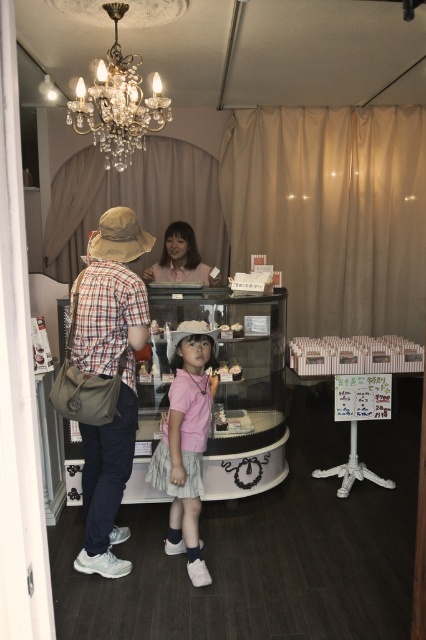
You are a photographer setting up a shoot in this bakery scene. You need to place a small tripod between the matte plaid shirt at center and the pink cotton shirt at center. Since the two shirts are overlapping, which shirt should the tripod be placed closer to to avoid blocking the smaller one?

The matte plaid shirt at center is larger in size than the pink cotton shirt at center, so the tripod should be placed closer to the pink cotton shirt at center to avoid blocking it.

You are a photographer setting up a shot in this bakery scene. You need to ensure that the matte plaid shirt at center and the crystal chandelier at upper center are both in focus. Given their sizes, which object should you prioritize focusing on first to ensure depth of field?

The matte plaid shirt at center has a smaller size compared to the crystal chandelier at upper center. Since smaller objects require a narrower depth of field to capture details, you should prioritize focusing on the matte plaid shirt at center first.

You are a tailor observing a young girl wearing two pink shirts in a bakery. The shirts are labeled as the pink cotton shirt at center and the pink fabric shirt at center. Which of the two shirts is longer in height?

The pink cotton shirt at center is taller than the pink fabric shirt at center, so the pink cotton shirt at center is longer in height.